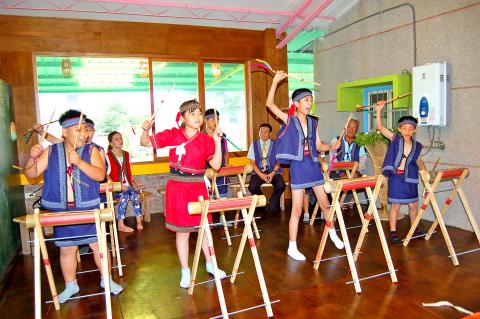
Locate an element on the screen. The height and width of the screenshot is (319, 480). wall is located at coordinates (455, 45).